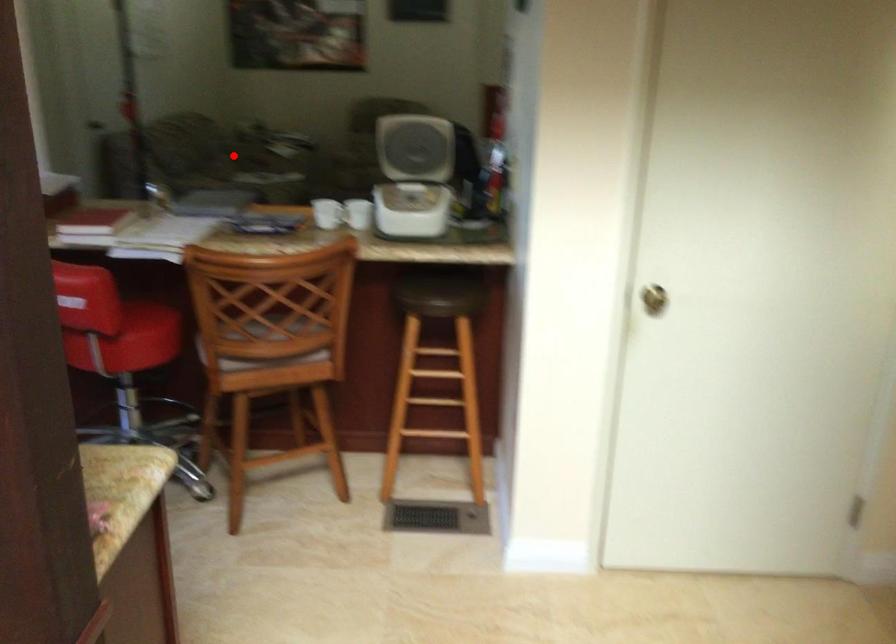
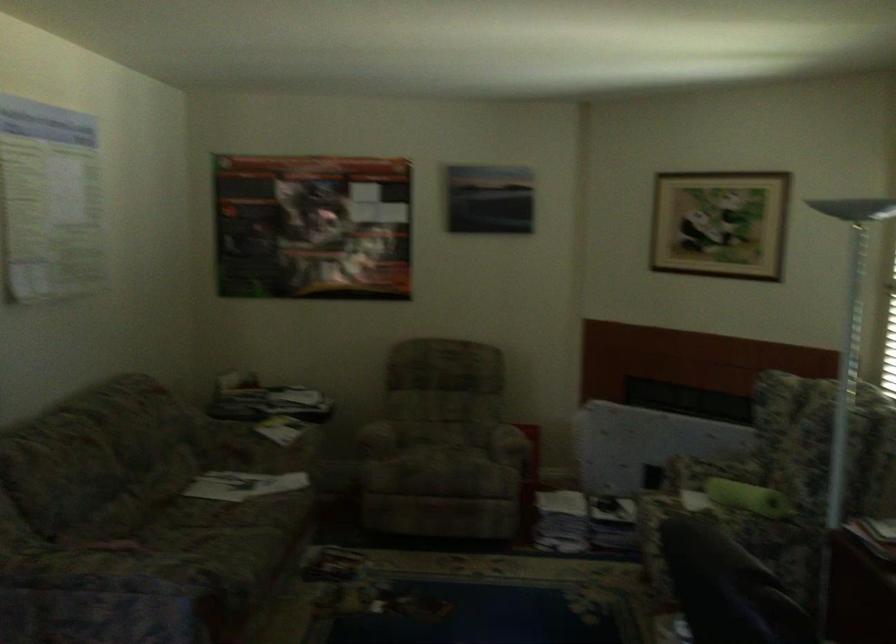
In the second image, find the point that corresponds to the highlighted location in the first image.

(217, 488)